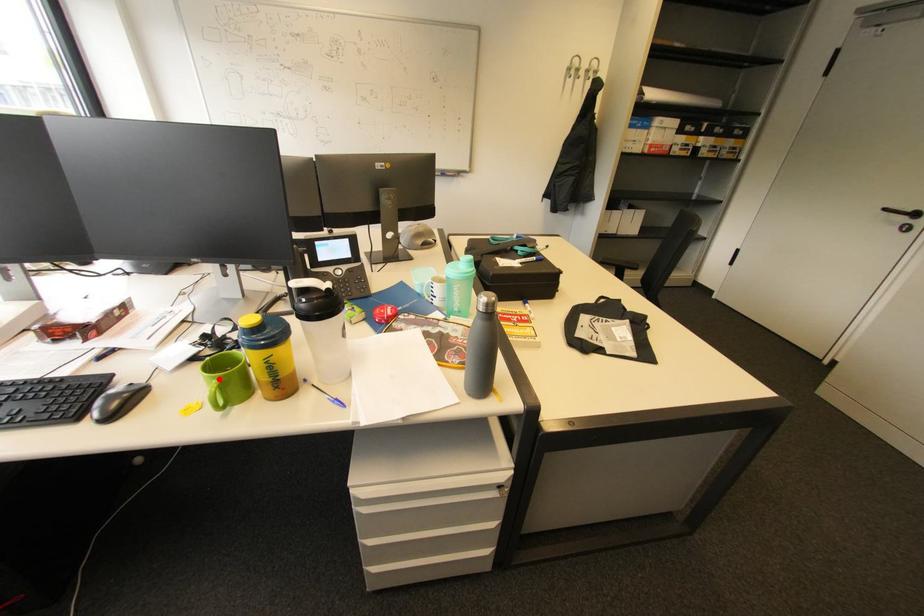
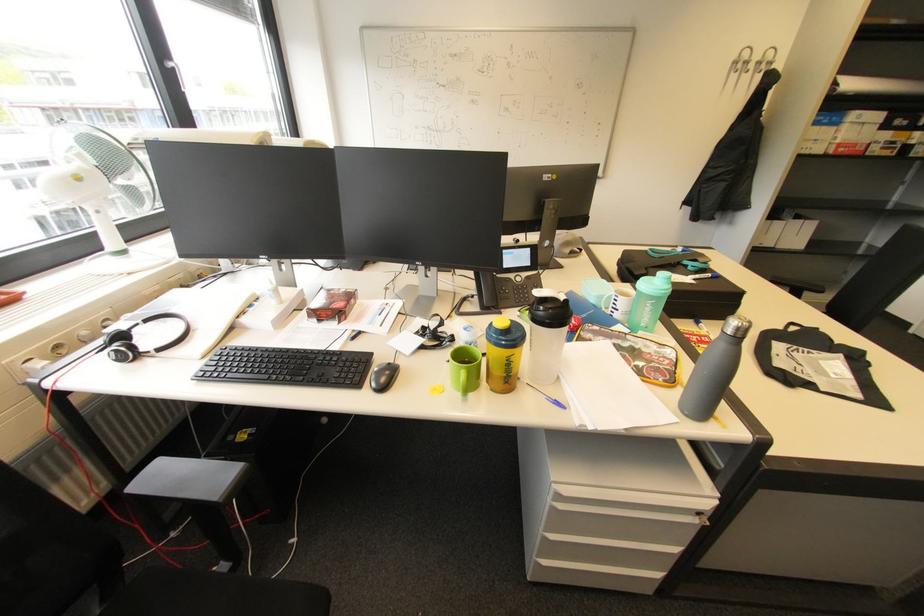
In the second image, find the point that corresponds to the highlighted location in the first image.

(468, 369)